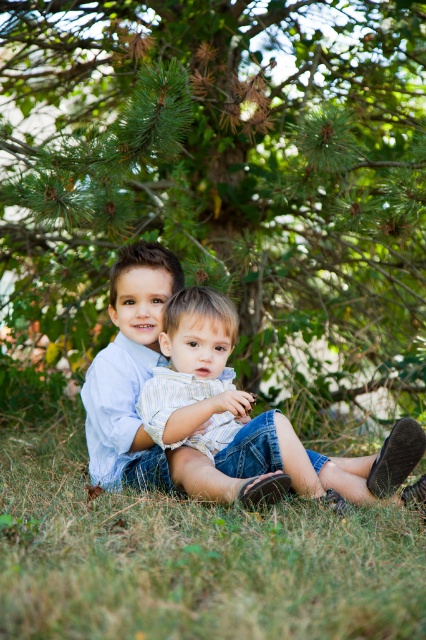
Question: Can you confirm if green textured pine tree at upper center is positioned to the left of striped cotton shirt at center?

Choices:
 (A) yes
 (B) no

Answer: (A)

Question: Which point is farther to the camera?

Choices:
 (A) (256, 436)
 (B) (48, 182)

Answer: (B)

Question: Does green textured pine tree at upper center come in front of green grass at lower center?

Choices:
 (A) yes
 (B) no

Answer: (B)

Question: Is green textured pine tree at upper center above striped cotton shirt at center?

Choices:
 (A) no
 (B) yes

Answer: (B)

Question: Which object appears closest to the camera in this image?

Choices:
 (A) green textured pine tree at upper center
 (B) green grass at lower center

Answer: (B)

Question: Which point is farther from the camera taking this photo?

Choices:
 (A) (224, 355)
 (B) (80, 17)
 (C) (314, 609)

Answer: (B)